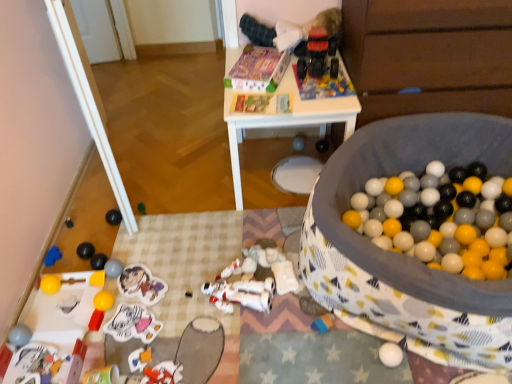
Locate an element on the screen. The width and height of the screenshot is (512, 384). vacant region above rubberized plastic toy car at center, the 20th toy in the left-to-right sequence (from a real-world perspective) is located at coordinates (323, 85).